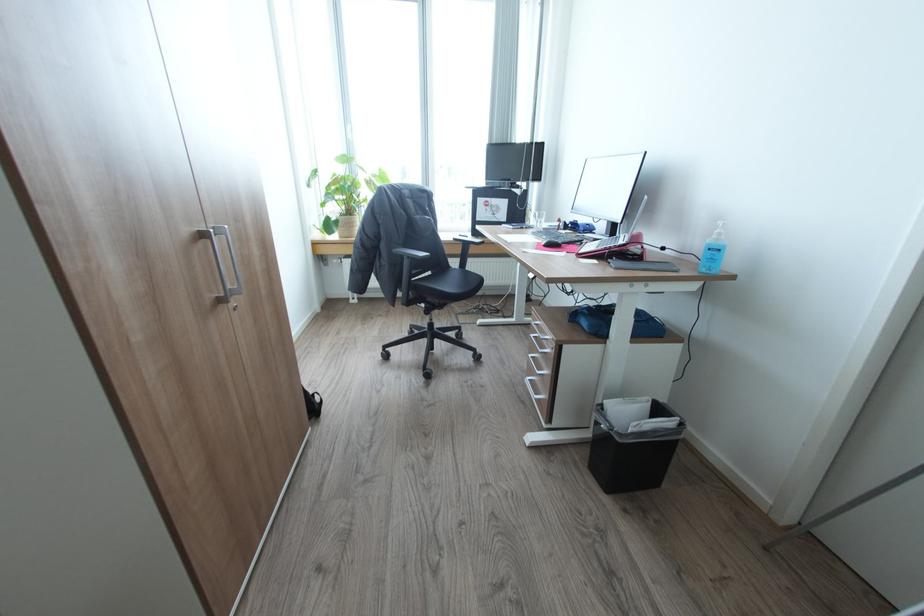
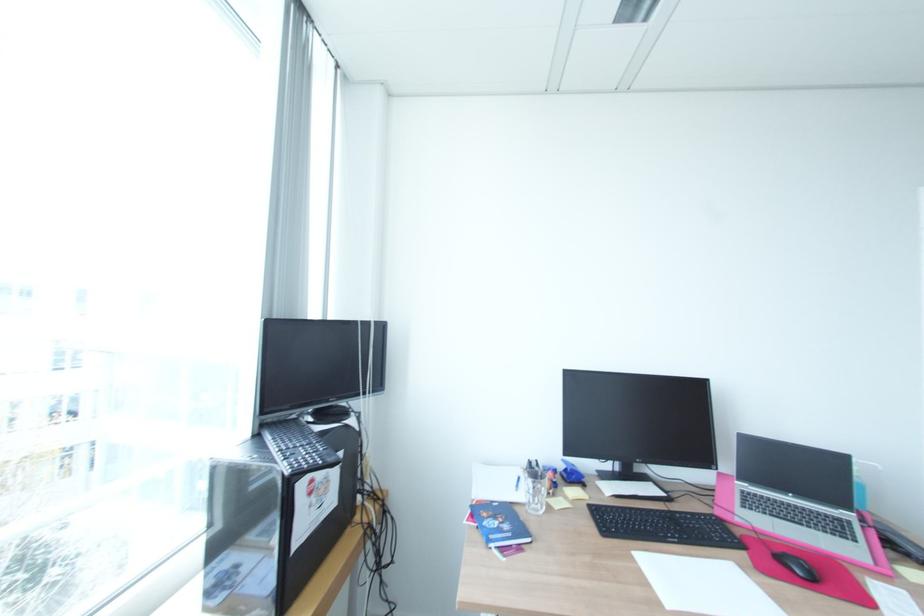
Locate, in the second image, the point that corresponds to pixel 541 143 in the first image.

(381, 321)